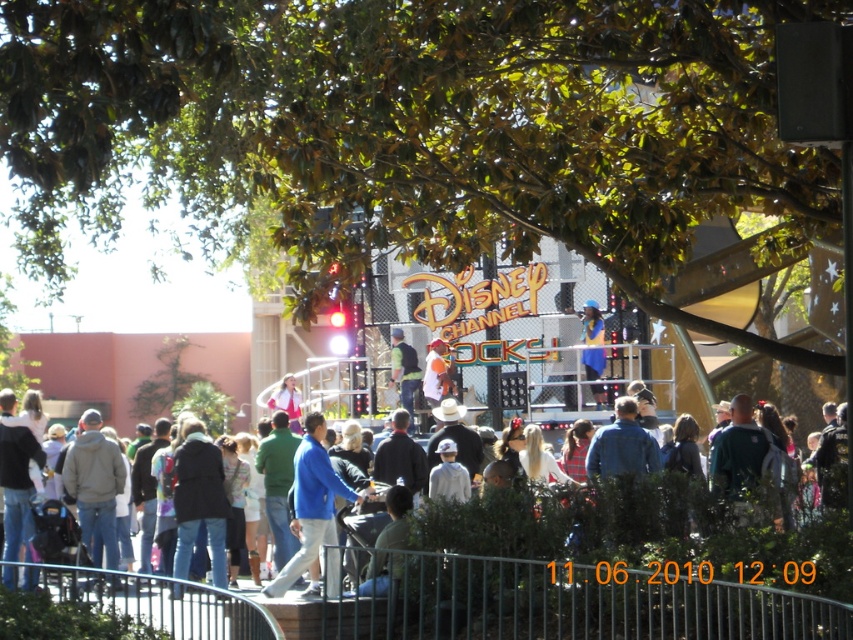
You are a costume designer at the event and need to determine which jacket to use for a promotional photo. The photo requires a jacket that is bigger in size. Which one should you choose between the blue fabric jacket at center and the green fabric jacket at center?

The blue fabric jacket at center is larger in size than the green fabric jacket at center, so you should choose the blue fabric jacket at center for the promotional photo.

You are a photographer at the Disney Channel Rock event. You need to capture a photo of both the blue fabric jacket at center and the green fabric jacket at center. Which jacket should you focus on first to ensure both are in frame?

The blue fabric jacket at center is taller than the green fabric jacket at center, so focus on positioning the taller blue fabric jacket at center first to ensure both are visible in the frame.